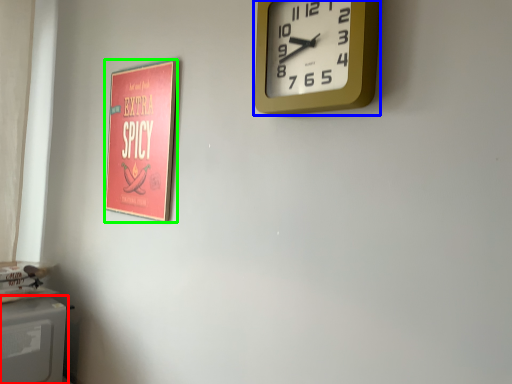
Question: Which is farther away from appliance (highlighted by a red box)? wall clock (highlighted by a blue box) or poster page (highlighted by a green box)?

Choices:
 (A) wall clock
 (B) poster page

Answer: (A)